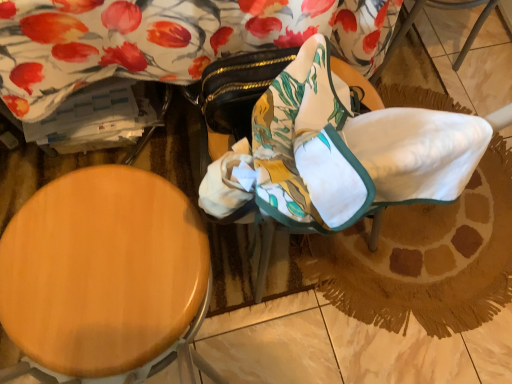
Question: Considering the positions of wooden stool at left and floral fabric swivel chair at center in the image, is wooden stool at left taller or shorter than floral fabric swivel chair at center?

Choices:
 (A) short
 (B) tall

Answer: (B)

Question: Is wooden stool at left in front of or behind floral fabric swivel chair at center in the image?

Choices:
 (A) front
 (B) behind

Answer: (A)

Question: Looking at the image, does wooden stool at left seem bigger or smaller compared to floral fabric swivel chair at center?

Choices:
 (A) small
 (B) big

Answer: (B)

Question: Would you say floral fabric swivel chair at center is to the left or to the right of wooden stool at left in the picture?

Choices:
 (A) right
 (B) left

Answer: (A)

Question: Do you think floral fabric swivel chair at center is within wooden stool at left, or outside of it?

Choices:
 (A) inside
 (B) outside

Answer: (B)

Question: Relative to wooden stool at left, is floral fabric swivel chair at center in front or behind?

Choices:
 (A) front
 (B) behind

Answer: (B)

Question: Considering the positions of floral fabric swivel chair at center and wooden stool at left in the image, is floral fabric swivel chair at center wider or thinner than wooden stool at left?

Choices:
 (A) thin
 (B) wide

Answer: (A)